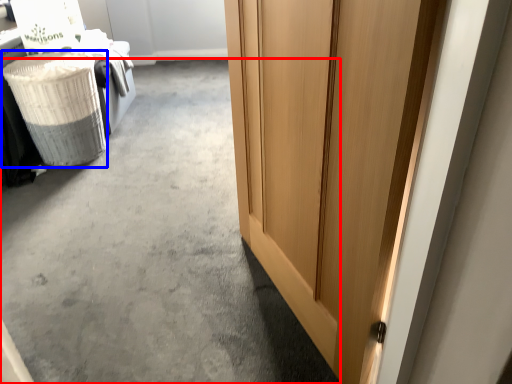
Question: Which point is closer to the camera, concrete (highlighted by a red box) or laundry basket (highlighted by a blue box)?

Choices:
 (A) concrete
 (B) laundry basket

Answer: (A)